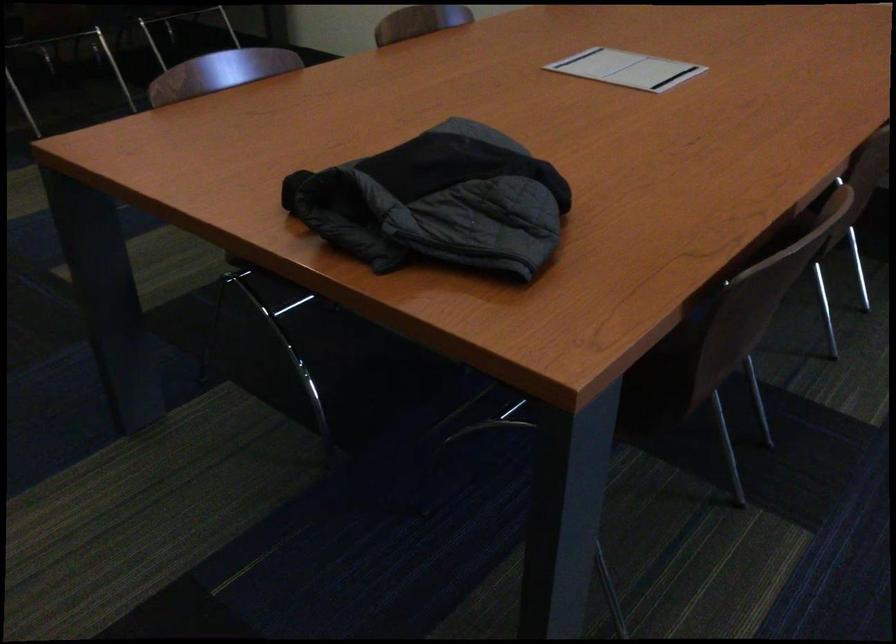
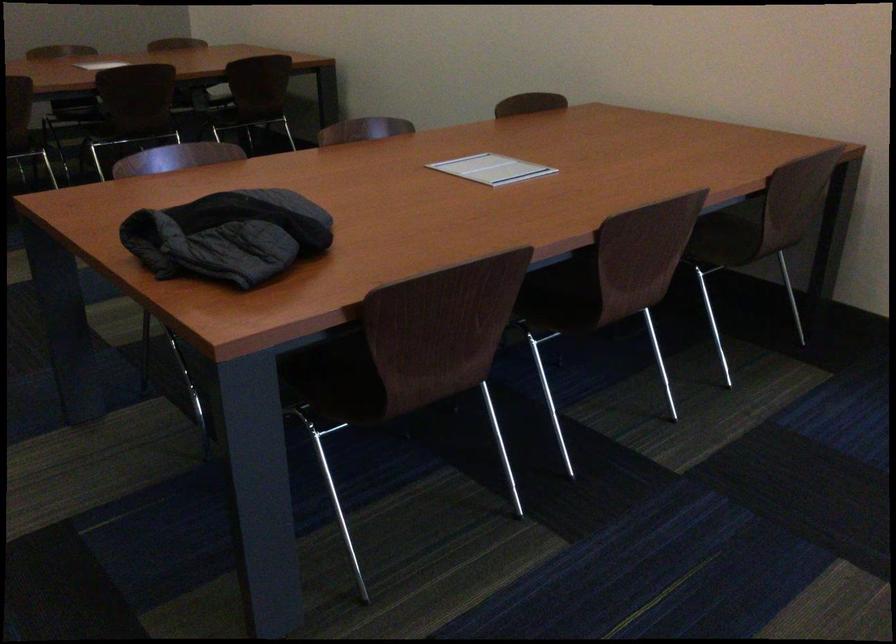
The point at (469,194) is marked in the first image. Where is the corresponding point in the second image?

(228, 236)